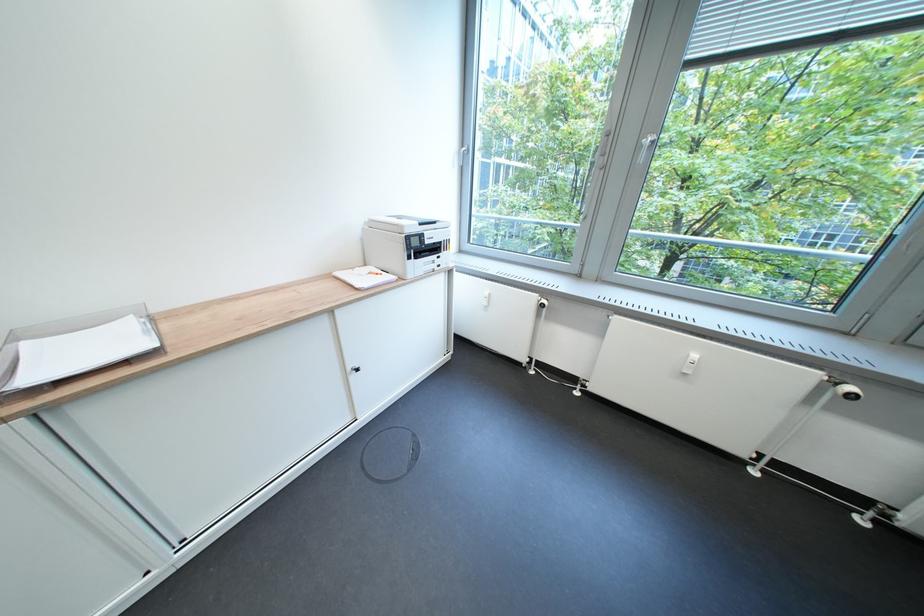
Find where to lift the printer scanner lid. Please return your answer as a coordinate pair (x, y).

(74, 346)